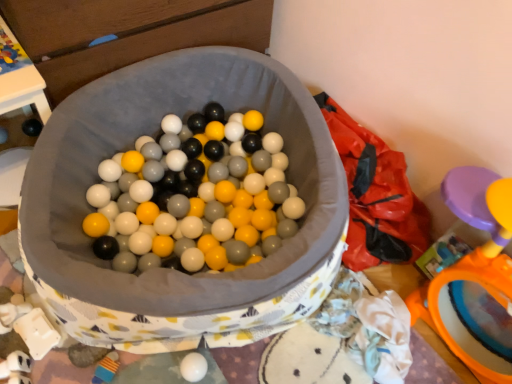
Find the location of `blank space to the left of white matte egg at center`. blank space to the left of white matte egg at center is located at coordinates click(x=137, y=367).